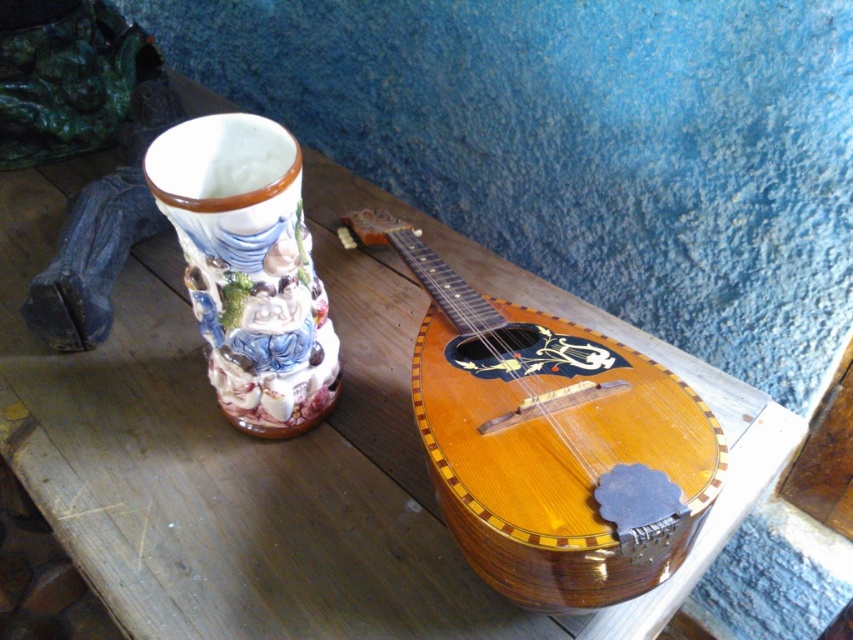
Is wooden banjo at center below decorative ceramic vase at left?

Correct, wooden banjo at center is located below decorative ceramic vase at left.

Which is more to the right, wooden banjo at center or decorative ceramic vase at left?

wooden banjo at center

Which is in front, point (697, 472) or point (235, 392)?

Point (697, 472) is more forward.

Image resolution: width=853 pixels, height=640 pixels. I want to click on wooden banjo at center, so click(548, 440).